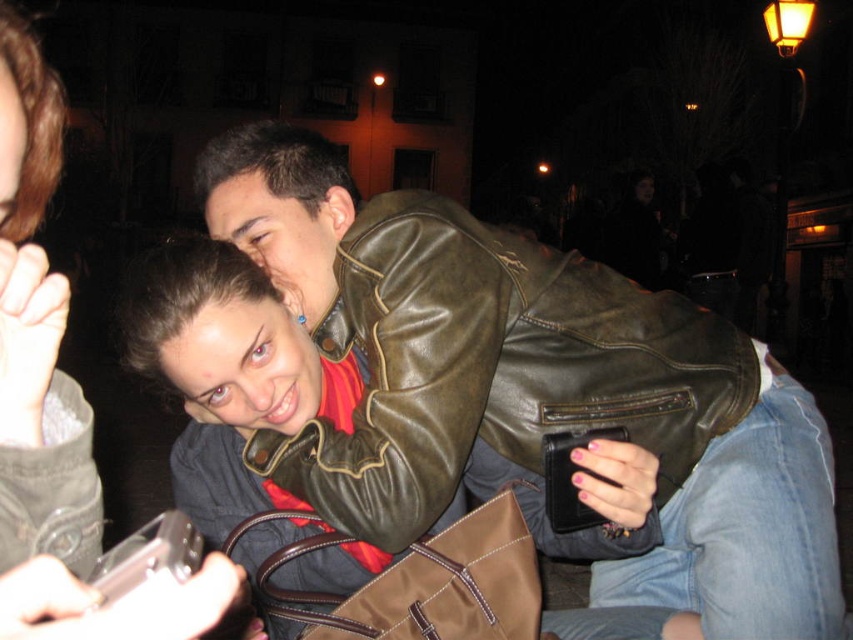
You are a photographer trying to capture a closeup of the woman in the image. You notice two points marked as point 1 at coordinates point [397,448] and point 2 at coordinates point [33,563]. Which point should you focus on to ensure the woman is in focus?

You should focus on point 1 at coordinates point [397,448] because it is closer to the camera than point 2 at coordinates point [33,563], ensuring the woman is in focus.

You are a photographer trying to capture a candid shot of the woman in the scene. You notice the shiny brown leather jacket at center and the matte black phone at lower left. Which object is positioned closer to the right side of the frame?

The shiny brown leather jacket at center is to the right of the matte black phone at lower left, so it is positioned closer to the right side of the frame.

You are a photographer trying to capture the perfect shot of the shiny brown leather jacket at center and the matte black phone at lower left. Since the scene is dimly lit, you want to ensure both objects are visible. Considering their sizes, which object should you focus on first to ensure proper exposure?

The shiny brown leather jacket at center has a greater height compared to the matte black phone at lower left, so you should focus on the shiny brown leather jacket at center first because it is larger and will require more attention to capture its details properly in the dim lighting.